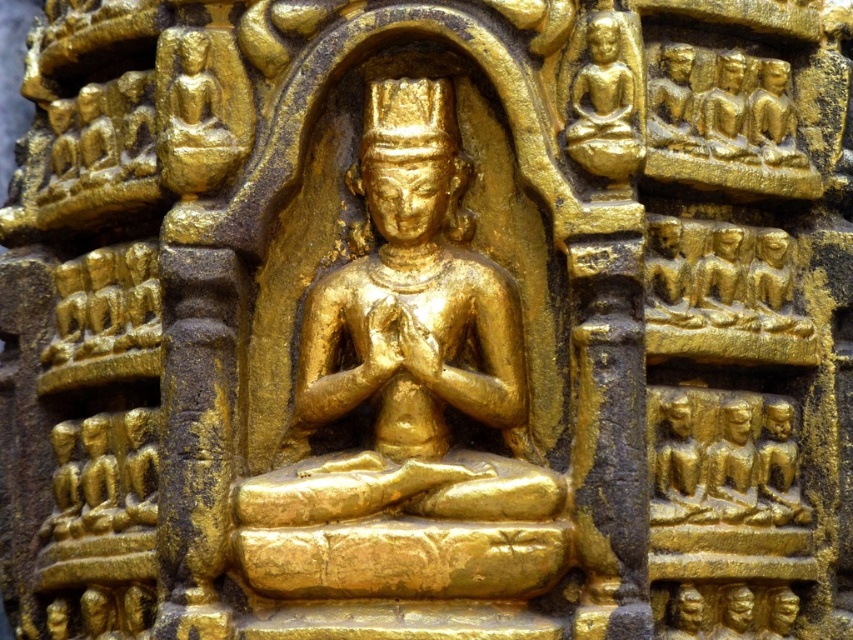
Question: Estimate the real-world distances between objects in this image. Which object is farther from the gold polished statue at upper right?

Choices:
 (A) gold/gilded statue at upper left
 (B) gold polished statue at center

Answer: (A)

Question: Is gold polished statue at center to the left of gold polished statue at upper right from the viewer's perspective?

Choices:
 (A) no
 (B) yes

Answer: (B)

Question: Where is gold polished statue at center located in relation to gold polished statue at upper right in the image?

Choices:
 (A) left
 (B) right

Answer: (A)

Question: Which point is farther to the camera?

Choices:
 (A) (363, 529)
 (B) (575, 44)

Answer: (B)

Question: Can you confirm if gold polished statue at center is thinner than gold polished statue at upper right?

Choices:
 (A) yes
 (B) no

Answer: (B)

Question: Which point is closer to the camera taking this photo?

Choices:
 (A) (573, 148)
 (B) (213, 60)
 (C) (335, 584)

Answer: (C)